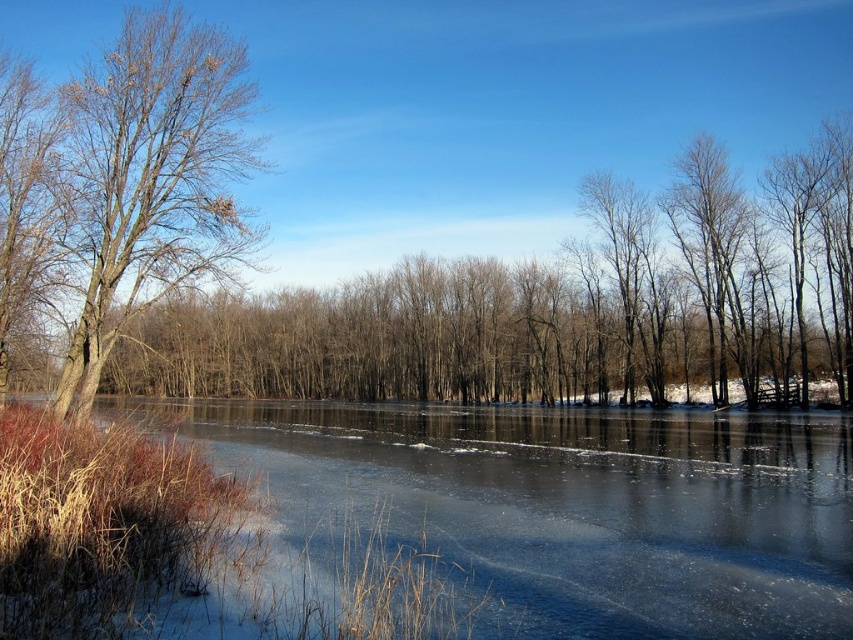
You are standing in the winter landscape and want to walk from the bare wood tree at left to the frozen ice at center. Which direction should you move?

You should move to the right to reach the frozen ice at center from the bare wood tree at left because the frozen ice at center is located to the right of the bare wood tree at left.

You are standing in the winter landscape and want to reach the point marked at coordinates [769,419]. If your walking speed is 1.5 meters per second, how long will it take you to reach that point?

The point marked at coordinates [769,419] is 45.65 meters away from the camera. At a walking speed of 1.5 meters per second, it will take approximately 30.43 seconds to reach the point.